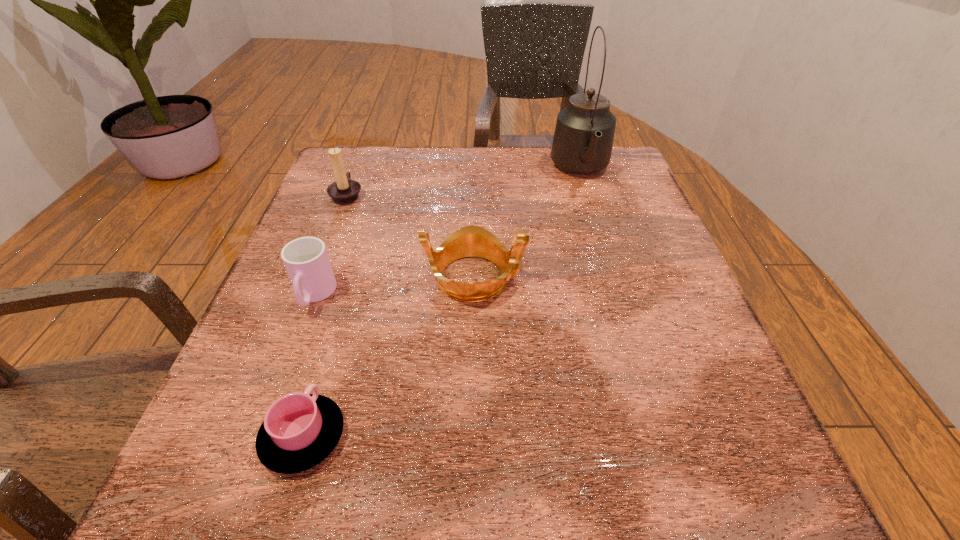
Where is `vacant space positioned at the front emblem of the tiara`? vacant space positioned at the front emblem of the tiara is located at coordinates click(x=628, y=277).

Identify the location of free location located 0.070m with the handle on the side of the fourth tallest object. The height and width of the screenshot is (540, 960). (293, 352).

In order to click on vacant space located 0.200m on the side with the handle of the nearer cup in this screenshot , I will do `click(345, 298)`.

Find the location of a particular element. The height and width of the screenshot is (540, 960). blank space located on the side with the handle of the nearer cup is located at coordinates (350, 279).

The width and height of the screenshot is (960, 540). I want to click on vacant area situated 0.240m on the side with the handle of the nearer cup, so click(x=349, y=282).

What are the coordinates of `kettle at the far edge` in the screenshot? It's located at (583, 139).

This screenshot has width=960, height=540. Identify the location of candle holder that is at the far edge. click(x=344, y=190).

Where is `object positioned at the near edge`? object positioned at the near edge is located at coordinates (300, 430).

Locate an element on the screen. candle holder at the left edge is located at coordinates (344, 190).

This screenshot has width=960, height=540. I want to click on object present at the right edge, so click(x=583, y=139).